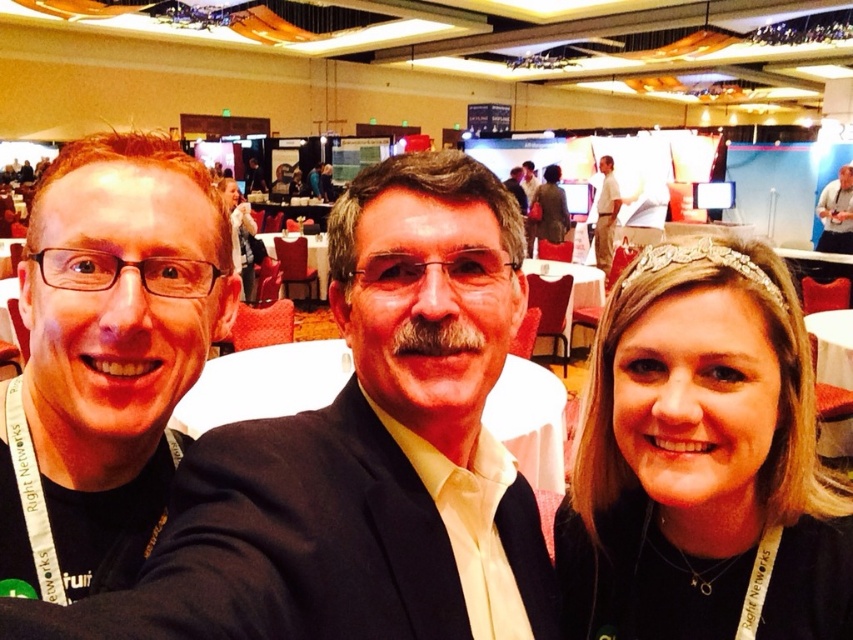
Is smooth black hair at center positioned in front of white tablecloth at center?

Yes, smooth black hair at center is closer to the viewer.

Who is more distant from viewer, (801, 497) or (303, 280)?

The point (303, 280) is behind.

Between point (596, 417) and point (281, 264), which one is positioned behind?

Point (281, 264)

The height and width of the screenshot is (640, 853). Identify the location of smooth black hair at center. (701, 460).

Who is more forward, (790, 586) or (837, 177)?

Point (790, 586) is more forward.

Does point (641, 422) come farther from viewer compared to point (828, 236)?

No, (641, 422) is closer to viewer.

What do you see at coordinates (701, 460) in the screenshot?
I see `smooth black hair at center` at bounding box center [701, 460].

The height and width of the screenshot is (640, 853). Identify the location of smooth black hair at center. (701, 460).

Is white tablecloth at center smaller than tan fabric shirt at upper center?

No.

This screenshot has width=853, height=640. What do you see at coordinates (300, 262) in the screenshot? I see `white tablecloth at center` at bounding box center [300, 262].

Is point (323, 259) in front of point (616, 196)?

That is True.

Identify the location of white tablecloth at center. This screenshot has width=853, height=640. (300, 262).